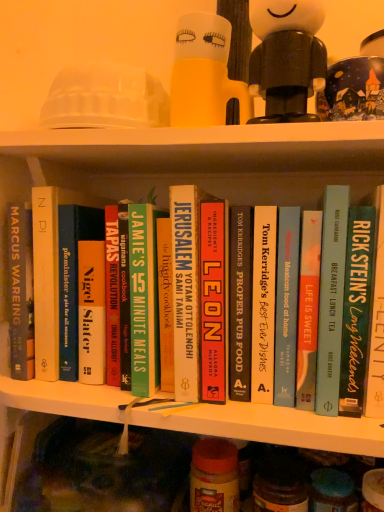
At what (x,y) coordinates should I click in order to perform the action: click on white hardcover book at center, the 8th book when ordered from right to left. Please return your answer as a coordinate pair (x, y). Looking at the image, I should click on (49, 273).

This screenshot has height=512, width=384. What do you see at coordinates (213, 300) in the screenshot?
I see `hardcover book at center, which is counted as the 5th book, starting from the right` at bounding box center [213, 300].

Locate an element on the screen. This screenshot has height=512, width=384. hardcover book at center, placed as the 3th book when sorted from right to left is located at coordinates (331, 298).

Where is `green matte book at center, the 2th book positioned from the left`? green matte book at center, the 2th book positioned from the left is located at coordinates (144, 298).

Measure the distance between white matte figurine at upper center and camera.

white matte figurine at upper center is 18.17 inches away from camera.

At what (x,y) coordinates should I click in order to perform the action: click on translucent yellow cup at upper center. Please return your answer as a coordinate pair (x, y). The height and width of the screenshot is (512, 384). Looking at the image, I should click on (205, 74).

Based on the photo, is white hardcover book at center, the 8th book when ordered from right to left, oriented towards hardcover book at center, acting as the 2th book starting from the right?

No, white hardcover book at center, the 8th book when ordered from right to left, is not facing towards hardcover book at center, acting as the 2th book starting from the right.

This screenshot has width=384, height=512. What are the coordinates of `the 1st book located beneath the white hardcover book at center, the 1th book when ordered from left to right (from a real-world perspective)` in the screenshot? It's located at tap(356, 309).

Is white hardcover book at center, the 1th book when ordered from left to right, not near hardcover book at center, acting as the 2th book starting from the right?

That's not correct — white hardcover book at center, the 1th book when ordered from left to right, is a little close to hardcover book at center, acting as the 2th book starting from the right.

Considering the sizes of white hardcover book at center, the 8th book when ordered from right to left, and hardcover book at center, acting as the 2th book starting from the right, in the image, is white hardcover book at center, the 8th book when ordered from right to left, wider or thinner than hardcover book at center, acting as the 2th book starting from the right,?

In the image, white hardcover book at center, the 8th book when ordered from right to left, appears to be wider than hardcover book at center, acting as the 2th book starting from the right.

Considering the sizes of objects green matte book at center, which appears as the 7th book when viewed from the right, and hardcover book at center, the sixth book from the left, in the image provided, who is shorter, green matte book at center, which appears as the 7th book when viewed from the right, or hardcover book at center, the sixth book from the left,?

green matte book at center, which appears as the 7th book when viewed from the right.

From the picture: Is green matte book at center, the 2th book positioned from the left, positioned beyond the bounds of hardcover book at center, placed as the 3th book when sorted from right to left?

green matte book at center, the 2th book positioned from the left, is positioned outside hardcover book at center, placed as the 3th book when sorted from right to left.

From the image's perspective, relative to hardcover book at center, the sixth book from the left, is green matte book at center, which appears as the 7th book when viewed from the right, above or below?

Clearly, from the image's perspective, green matte book at center, which appears as the 7th book when viewed from the right, is below hardcover book at center, the sixth book from the left.

Does green matte book at center, which appears as the 7th book when viewed from the right, have a smaller size compared to hardcover book at center, placed as the 3th book when sorted from right to left?

Yes, green matte book at center, which appears as the 7th book when viewed from the right, is smaller than hardcover book at center, placed as the 3th book when sorted from right to left.

Is blue glass jar at lower right, the first glass jar viewed from the right, completely or partially outside of hardcover book at center, placed as the 3th book when sorted from right to left?

Yes, blue glass jar at lower right, the first glass jar viewed from the right, is outside of hardcover book at center, placed as the 3th book when sorted from right to left.

Does blue glass jar at lower right, the second glass jar when ordered from left to right, appear on the right side of hardcover book at center, the sixth book from the left?

Yes, blue glass jar at lower right, the second glass jar when ordered from left to right, is to the right of hardcover book at center, the sixth book from the left.

From the image's perspective, count 6th books upward from the blue glass jar at lower right, the second glass jar when ordered from left to right, and point to it. Please provide its 2D coordinates.

[(331, 298)]

Is blue glass jar at lower right, the first glass jar viewed from the right, facing towards hardcover book at center, placed as the 3th book when sorted from right to left?

No, blue glass jar at lower right, the first glass jar viewed from the right, is not aimed at hardcover book at center, placed as the 3th book when sorted from right to left.

Considering the positions of objects white matte figurine at upper center and hardcover book at center, the 4th book positioned from the left, in the image provided, who is more to the left, white matte figurine at upper center or hardcover book at center, the 4th book positioned from the left,?

hardcover book at center, the 4th book positioned from the left.

Is white matte figurine at upper center looking in the opposite direction of hardcover book at center, the 4th book positioned from the left?

That's not correct — white matte figurine at upper center is not looking away from hardcover book at center, the 4th book positioned from the left.

How many degrees apart are the facing directions of white matte figurine at upper center and hardcover book at center, which is counted as the 5th book, starting from the right?

The angle between the facing direction of white matte figurine at upper center and the facing direction of hardcover book at center, which is counted as the 5th book, starting from the right, is 0.245 degrees.

Which of these two, white matte figurine at upper center or hardcover book at center, which is counted as the 5th book, starting from the right, stands shorter?

Standing shorter between the two is white matte figurine at upper center.

Looking at this image, from the image's perspective, which one is positioned lower, green matte book at center, the 2th book positioned from the left, or translucent yellow cup at upper center?

green matte book at center, the 2th book positioned from the left.

Considering the sizes of objects green matte book at center, the 2th book positioned from the left, and translucent yellow cup at upper center in the image provided, who is bigger, green matte book at center, the 2th book positioned from the left, or translucent yellow cup at upper center?

translucent yellow cup at upper center.

From the picture: Considering the relative positions of green matte book at center, the 2th book positioned from the left, and translucent yellow cup at upper center in the image provided, is green matte book at center, the 2th book positioned from the left, to the left or to the right of translucent yellow cup at upper center?

Based on their positions, green matte book at center, the 2th book positioned from the left, is located to the left of translucent yellow cup at upper center.

Is translucent yellow cup at upper center bigger than hardcover book at center, positioned as the 8th book in left-to-right order?

Incorrect, translucent yellow cup at upper center is not larger than hardcover book at center, positioned as the 8th book in left-to-right order.

Between translucent yellow cup at upper center and hardcover book at center, positioned as the 8th book in left-to-right order, which one is positioned behind?

translucent yellow cup at upper center is further away from the camera.

Are translucent yellow cup at upper center and hardcover book at center, placed as the first book when sorted from right to left, beside each other?

No, translucent yellow cup at upper center is not in contact with hardcover book at center, placed as the first book when sorted from right to left.

Would you say translucent yellow cup at upper center is inside or outside hardcover book at center, positioned as the 8th book in left-to-right order?

The correct answer is: outside.

In the image, is hardcover book at center, positioned as the 8th book in left-to-right order, positioned in front of or behind translucent plastic jar at center, which is the 1th glass jar from left to right?

In the image, hardcover book at center, positioned as the 8th book in left-to-right order, appears in front of translucent plastic jar at center, which is the 1th glass jar from left to right.

Is hardcover book at center, positioned as the 8th book in left-to-right order, completely or partially outside of translucent plastic jar at center, arranged as the second glass jar when viewed from the right?

Yes.

Image resolution: width=384 pixels, height=512 pixels. What are the coordinates of `the 1st book above the translucent plastic jar at center, arranged as the second glass jar when viewed from the right (from the image's perspective)` in the screenshot? It's located at (376, 322).

Considering the sizes of objects hardcover book at center, placed as the first book when sorted from right to left, and translucent plastic jar at center, which is the 1th glass jar from left to right, in the image provided, who is taller, hardcover book at center, placed as the first book when sorted from right to left, or translucent plastic jar at center, which is the 1th glass jar from left to right,?

With more height is hardcover book at center, placed as the first book when sorted from right to left.

Which book is the 6th one when counting from the right side of the white hardcover book at center, the 1th book when ordered from left to right? Please provide its 2D coordinates.

[(356, 309)]

Starting from the hardcover book at center, the sixth book from the left, which book is the 5th one behind? Please provide its 2D coordinates.

[(144, 298)]

Which object lies further to the anchor point hardcover book at center, positioned as the 8th book in left-to-right order, white hardcover book at center, the 8th book when ordered from right to left, or translucent plastic jar at center, which is the 1th glass jar from left to right?

Based on the image, white hardcover book at center, the 8th book when ordered from right to left, appears to be further to hardcover book at center, positioned as the 8th book in left-to-right order.

Looking at the image, which one is located further to hardcover book at center, positioned as the 8th book in left-to-right order, hardcover cookbook at center, which is the third book in left-to-right order, or white matte figurine at upper center?

hardcover cookbook at center, which is the third book in left-to-right order, is positioned further to the anchor hardcover book at center, positioned as the 8th book in left-to-right order.

Looking at the image, which one is located further to translucent plastic jar at center, arranged as the second glass jar when viewed from the right, hardcover book at center, placed as the first book when sorted from right to left, or translucent yellow cup at upper center?

translucent yellow cup at upper center is further to translucent plastic jar at center, arranged as the second glass jar when viewed from the right.

Estimate the real-world distances between objects in this image. Which object is closer to hardcover book at center, the 7th book when ordered from left to right, white matte figurine at upper center or translucent plastic jar at center, which is the 1th glass jar from left to right?

white matte figurine at upper center is positioned closer to the anchor hardcover book at center, the 7th book when ordered from left to right.

Estimate the real-world distances between objects in this image. Which object is closer to translucent plastic jar at center, which is the 1th glass jar from left to right, hardcover book at center, positioned as the 8th book in left-to-right order, or hardcover book at center, the 4th book positioned from the left?

hardcover book at center, the 4th book positioned from the left, is closer to translucent plastic jar at center, which is the 1th glass jar from left to right.

When comparing their distances from hardcover book at center, placed as the 3th book when sorted from right to left, does translucent plastic jar at center, which is the 1th glass jar from left to right, or translucent yellow cup at upper center seem further?

Based on the image, translucent plastic jar at center, which is the 1th glass jar from left to right, appears to be further to hardcover book at center, placed as the 3th book when sorted from right to left.

Looking at the image, which one is located closer to white matte figurine at upper center, white hardcover book at center, the 1th book when ordered from left to right, or hardcover cookbook at center, which is the third book in left-to-right order?

Based on the image, hardcover cookbook at center, which is the third book in left-to-right order, appears to be nearer to white matte figurine at upper center.

Based on their spatial positions, is hardcover book at center, acting as the 2th book starting from the right, or white hardcover book at center, the 1th book when ordered from left to right, further from translucent yellow cup at upper center?

white hardcover book at center, the 1th book when ordered from left to right, is positioned further to the anchor translucent yellow cup at upper center.

This screenshot has height=512, width=384. Find the location of `book located between black hardcover book at center, which is counted as the 5th book, starting from the left, and hardcover book at center, acting as the 2th book starting from the right, in the left-right direction`. book located between black hardcover book at center, which is counted as the 5th book, starting from the left, and hardcover book at center, acting as the 2th book starting from the right, in the left-right direction is located at coordinates (331, 298).

The width and height of the screenshot is (384, 512). I want to click on figurine located between white hardcover book at center, the 1th book when ordered from left to right, and hardcover book at center, placed as the first book when sorted from right to left, in the left-right direction, so click(287, 57).

Identify the location of book between black hardcover book at center, marked as the 4th book in a right-to-left arrangement, and translucent plastic jar at center, arranged as the second glass jar when viewed from the right, in the up-down direction. This screenshot has height=512, width=384. (376, 322).

Identify the location of toy between white matte figurine at upper center and white hardcover book at center, the 1th book when ordered from left to right, vertically. (205, 74).